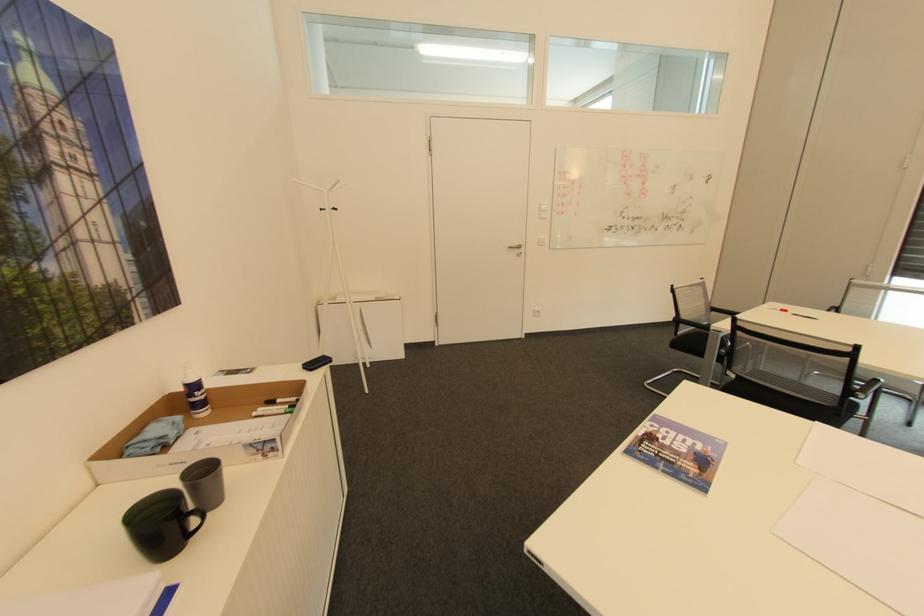
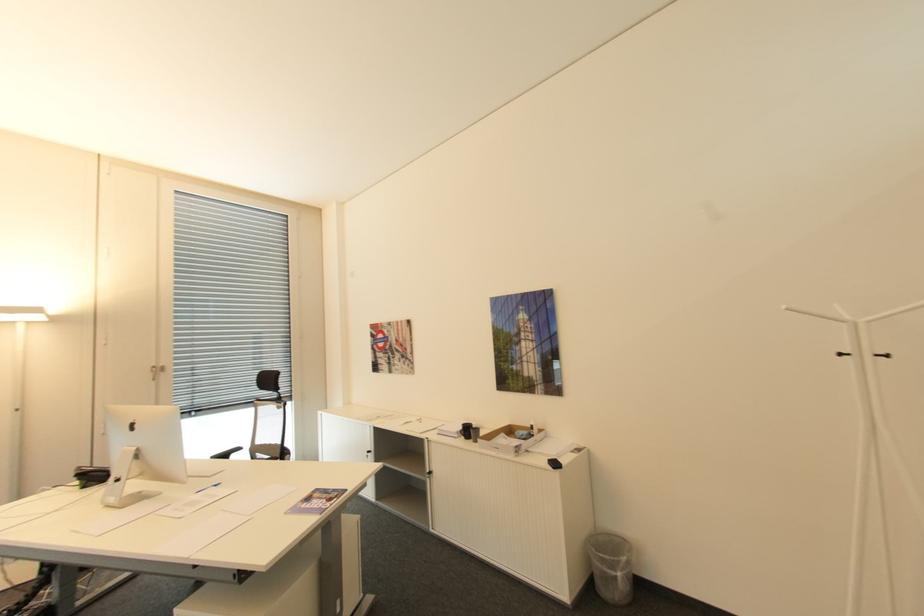
In the second image, find the point that corresponds to pixel 345 177 in the first image.

(791, 307)